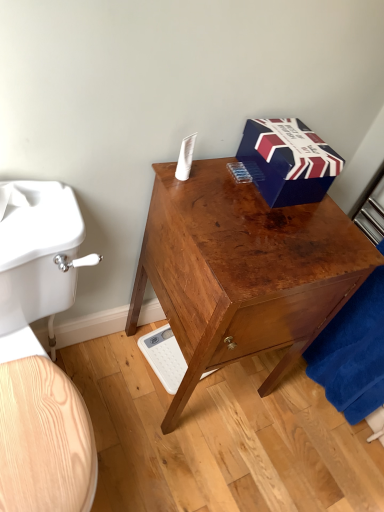
Locate an element on the screen. This screenshot has width=384, height=512. free space in front of blue cardboard box at upper right is located at coordinates (275, 218).